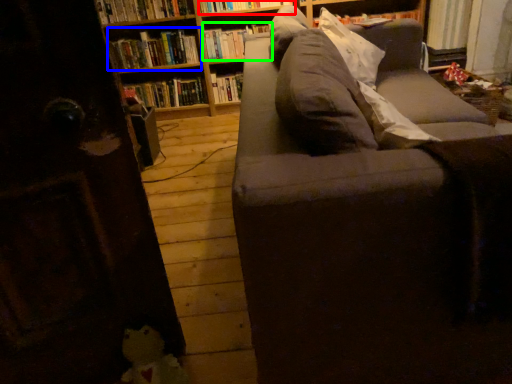
Question: Which is nearer to the book (highlighted by a red box)? book (highlighted by a blue box) or book (highlighted by a green box).

Choices:
 (A) book
 (B) book

Answer: (B)